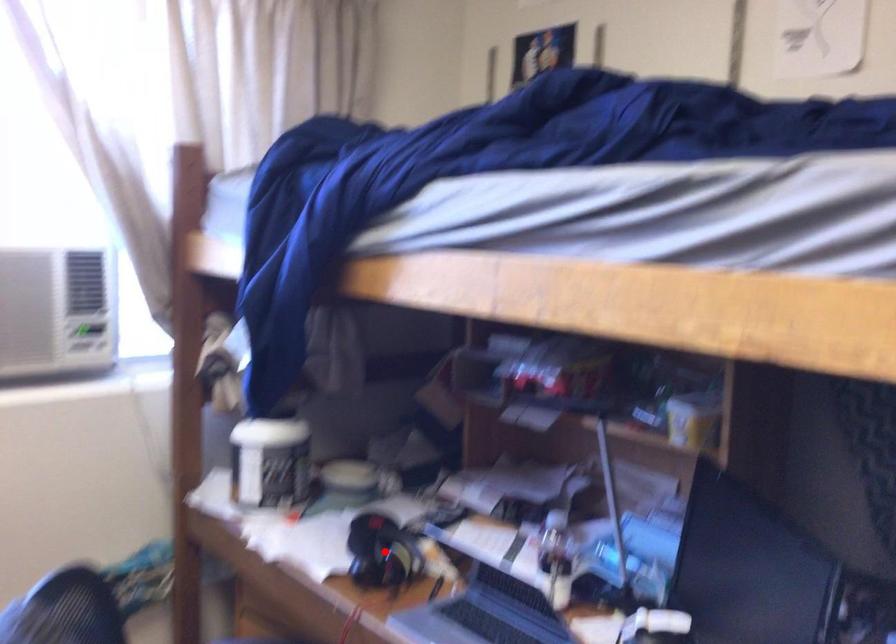
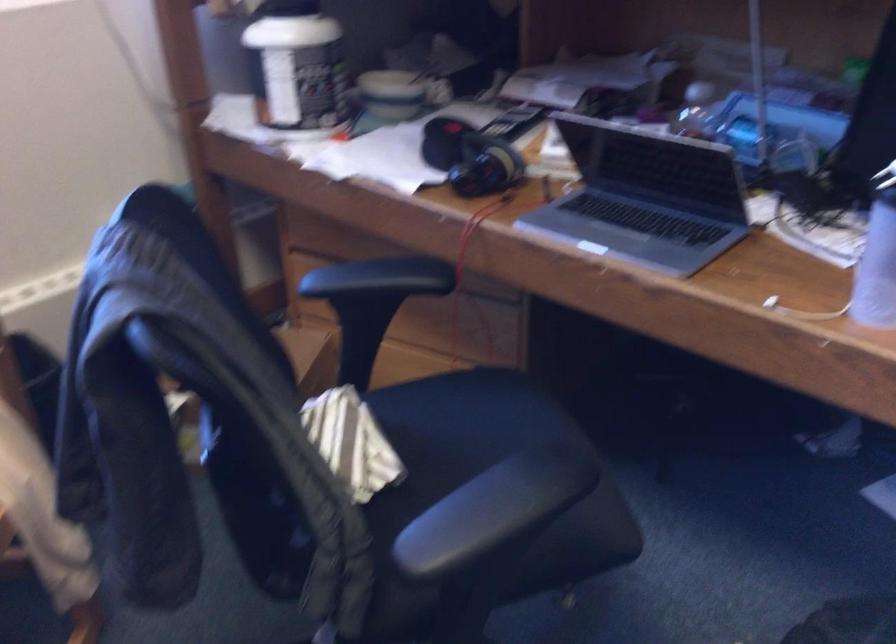
Question: I am providing you with two images of the same scene from different viewpoints. Given a red point in image1, look at the same physical point in image2. Is it:

Choices:
 (A) Closer to the viewpoint
 (B) Farther from the viewpoint

Answer: (A)